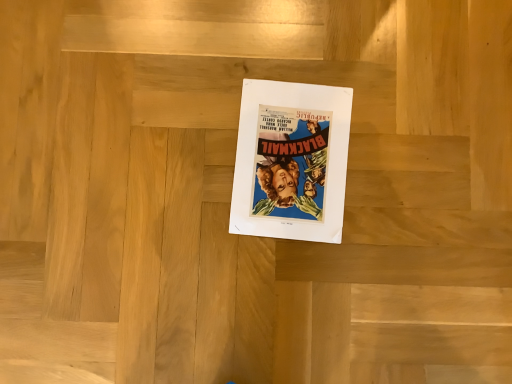
In order to face matte paper poster at center, should I rotate leftwards or rightwards?

You should look right and rotate roughly 5.036 degrees.

The image size is (512, 384). What do you see at coordinates (291, 161) in the screenshot? I see `matte paper poster at center` at bounding box center [291, 161].

What is the approximate height of matte paper poster at center?

1.00 centimeters.

Locate an element on the screen. matte paper poster at center is located at coordinates (291, 161).

At what (x,y) coordinates should I click in order to perform the action: click on matte paper poster at center. Please return your answer as a coordinate pair (x, y). The height and width of the screenshot is (384, 512). Looking at the image, I should click on (291, 161).